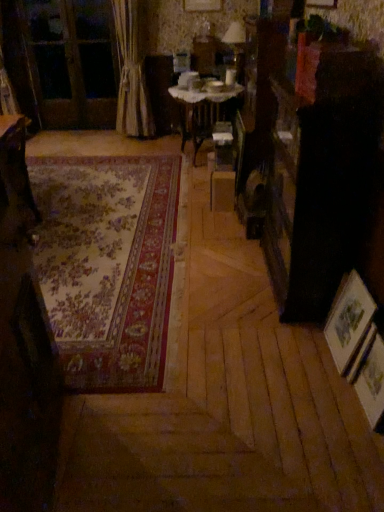
Question: Does matte glass table lamp at upper center appear on the left side of beige fabric curtain at left?

Choices:
 (A) yes
 (B) no

Answer: (B)

Question: Would you say matte glass table lamp at upper center is a long distance from beige fabric curtain at left?

Choices:
 (A) yes
 (B) no

Answer: (A)

Question: Is matte glass table lamp at upper center placed right next to beige fabric curtain at left?

Choices:
 (A) yes
 (B) no

Answer: (B)

Question: Considering the relative sizes of matte glass table lamp at upper center and beige fabric curtain at left in the image provided, is matte glass table lamp at upper center smaller than beige fabric curtain at left?

Choices:
 (A) yes
 (B) no

Answer: (A)

Question: Is matte glass table lamp at upper center positioned before beige fabric curtain at left?

Choices:
 (A) yes
 (B) no

Answer: (B)

Question: Is wooden screen door at upper left inside or outside of wooden table at center, the first table when ordered from back to front?

Choices:
 (A) outside
 (B) inside

Answer: (A)

Question: In terms of height, does wooden screen door at upper left look taller or shorter compared to wooden table at center, placed as the 2th table when sorted from left to right?

Choices:
 (A) tall
 (B) short

Answer: (A)

Question: From the image's perspective, is wooden screen door at upper left located above or below wooden table at center, the 2th table from the bottom?

Choices:
 (A) below
 (B) above

Answer: (B)

Question: Looking at their shapes, would you say wooden screen door at upper left is wider or thinner than wooden table at center, which is the 1th table from top to bottom?

Choices:
 (A) thin
 (B) wide

Answer: (A)

Question: From a real-world perspective, is floral carpet at center positioned above or below matte glass table lamp at upper center?

Choices:
 (A) below
 (B) above

Answer: (A)

Question: Choose the correct answer: Is floral carpet at center inside matte glass table lamp at upper center or outside it?

Choices:
 (A) outside
 (B) inside

Answer: (A)

Question: Considering their positions, is floral carpet at center located in front of or behind matte glass table lamp at upper center?

Choices:
 (A) behind
 (B) front

Answer: (B)

Question: Is point (104, 388) positioned closer to the camera than point (228, 34)?

Choices:
 (A) closer
 (B) farther

Answer: (A)

Question: Considering the positions of wooden table at left, acting as the 1th table starting from the bottom, and wooden picture frame at lower right, marked as the second picture frame in a back-to-front arrangement, in the image, is wooden table at left, acting as the 1th table starting from the bottom, wider or thinner than wooden picture frame at lower right, marked as the second picture frame in a back-to-front arrangement,?

Choices:
 (A) wide
 (B) thin

Answer: (A)

Question: From their relative heights in the image, would you say wooden table at left, marked as the 2th table in a right-to-left arrangement, is taller or shorter than wooden picture frame at lower right, marked as the second picture frame in a back-to-front arrangement?

Choices:
 (A) short
 (B) tall

Answer: (B)